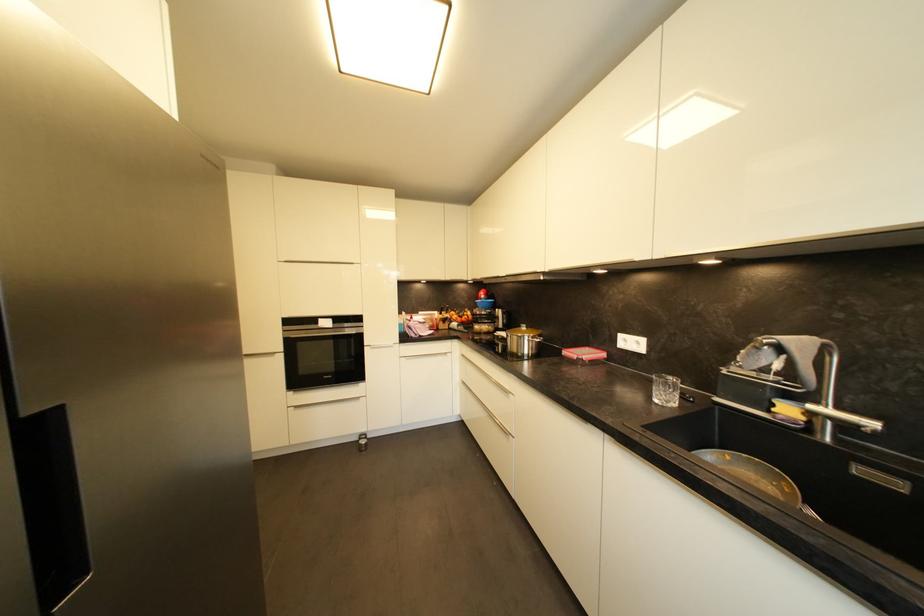
What do you see at coordinates (584, 353) in the screenshot?
I see `the pink container lid` at bounding box center [584, 353].